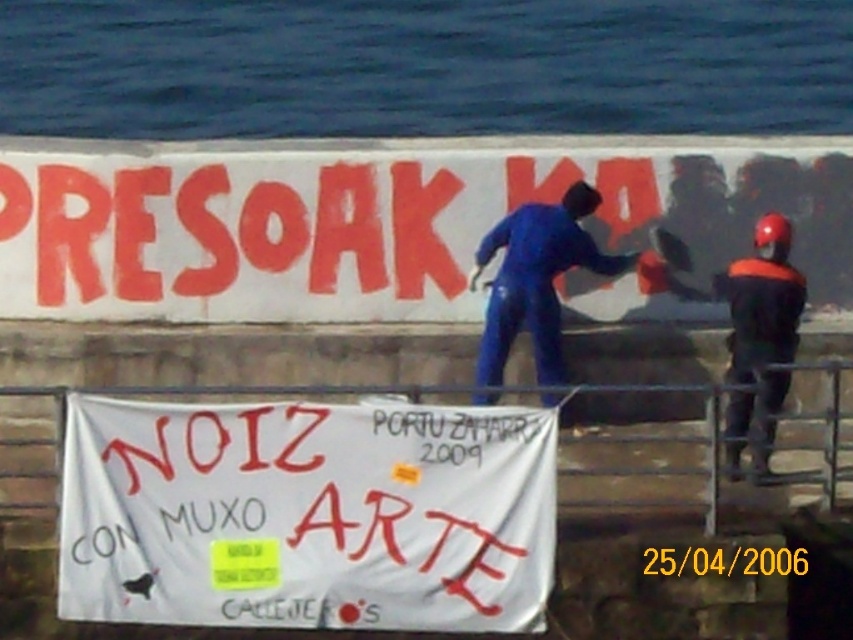
In the scene shown: You are a photographer taking a picture of the scene. You notice the white paper banner at lower center and the yellow paper sticker at lower center. Which object should you focus on first if you want to capture both in your shot without moving the camera?

The white paper banner at lower center is above the yellow paper sticker at lower center. Since the banner is higher up, you should focus on the white paper banner at lower center first to ensure both are in frame without moving the camera.